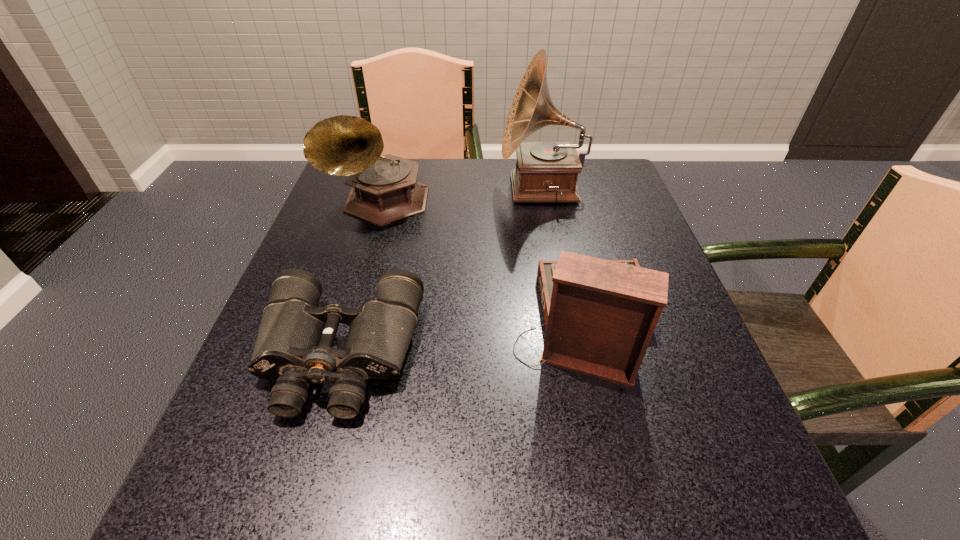
Where is `vacant point located on the back of the nearest phonograph record`? vacant point located on the back of the nearest phonograph record is located at coordinates [552, 193].

The image size is (960, 540). In order to click on vacant region located through the eyepieces of the shortest object in this screenshot , I will do `click(288, 534)`.

You are a GUI agent. You are given a task and a screenshot of the screen. Output one action in this format:
    pyautogui.click(x=<x>, y=<y>)
    Task: Click on the phonograph record situated at the left edge
    This screenshot has height=540, width=960.
    Given the screenshot: What is the action you would take?
    pyautogui.click(x=384, y=189)

At what (x,y) coordinates should I click in order to perform the action: click on binoculars situated at the left edge. Please return your answer as a coordinate pair (x, y). The height and width of the screenshot is (540, 960). Looking at the image, I should click on (294, 344).

Image resolution: width=960 pixels, height=540 pixels. I want to click on object located at the far left corner, so click(384, 189).

Find the location of a particular element. object present at the far right corner is located at coordinates (545, 171).

Where is `free region at the far edge of the desktop`? The image size is (960, 540). free region at the far edge of the desktop is located at coordinates (468, 158).

The image size is (960, 540). Find the location of `vacant region at the near edge of the desktop`. vacant region at the near edge of the desktop is located at coordinates (383, 483).

You are a GUI agent. You are given a task and a screenshot of the screen. Output one action in this format:
    pyautogui.click(x=<x>, y=<y>)
    Task: Click on the free space at the left edge
    The height and width of the screenshot is (540, 960).
    Given the screenshot: What is the action you would take?
    pyautogui.click(x=316, y=238)

In the image, there is a desktop. Identify the location of free region at the right edge. (628, 388).